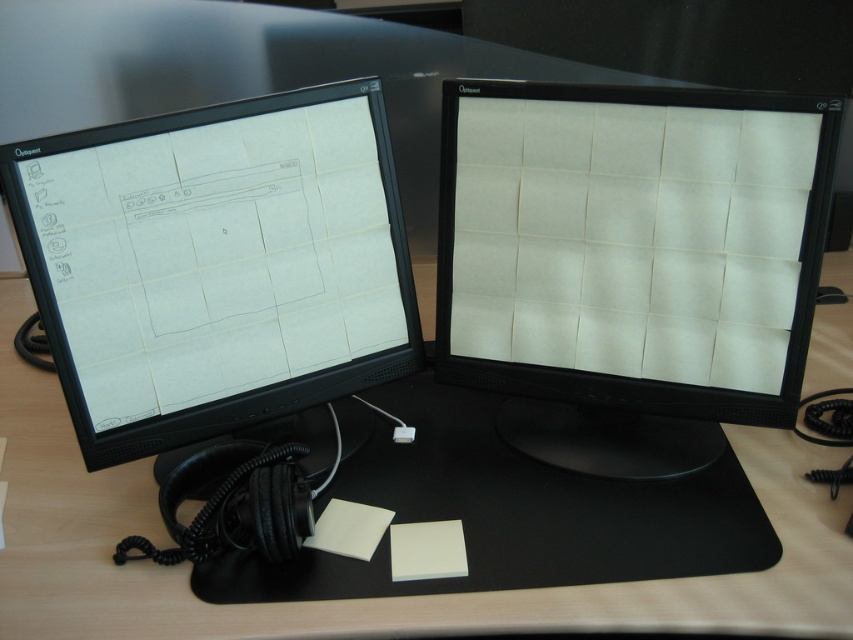
Is matte black monitor at left smaller than wooden table at center?

Yes.

Which is more to the right, matte black monitor at left or wooden table at center?

wooden table at center

Where is `matte black monitor at left`? The height and width of the screenshot is (640, 853). matte black monitor at left is located at coordinates (216, 264).

The height and width of the screenshot is (640, 853). I want to click on matte black monitor at left, so click(x=216, y=264).

Is white matte computer monitor at center above wooden table at center?

Correct, white matte computer monitor at center is located above wooden table at center.

Describe the element at coordinates (630, 262) in the screenshot. I see `white matte computer monitor at center` at that location.

What do you see at coordinates (630, 262) in the screenshot?
I see `white matte computer monitor at center` at bounding box center [630, 262].

Where is `white matte computer monitor at center`? white matte computer monitor at center is located at coordinates (630, 262).

Is white matte computer monitor at center thinner than matte black monitor at left?

Indeed, white matte computer monitor at center has a lesser width compared to matte black monitor at left.

Between point (583, 205) and point (340, 179), which one is positioned in front?

Point (583, 205) is more forward.

You are a GUI agent. You are given a task and a screenshot of the screen. Output one action in this format:
    pyautogui.click(x=<x>, y=<y>)
    Task: Click on the white matte computer monitor at center
    The height and width of the screenshot is (640, 853).
    Given the screenshot: What is the action you would take?
    pyautogui.click(x=630, y=262)